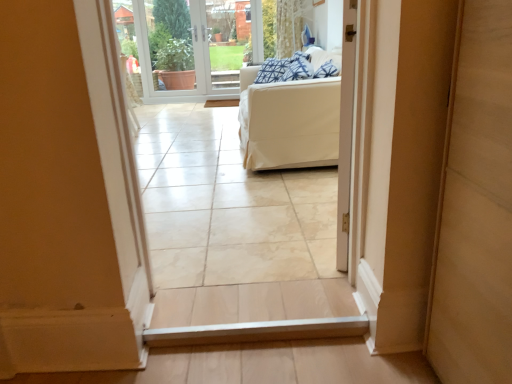
Question: From the image's perspective, is blue patterned pillow at upper center located beneath transparent glass door at center?

Choices:
 (A) yes
 (B) no

Answer: (A)

Question: Is blue patterned pillow at upper center outside transparent glass door at center?

Choices:
 (A) no
 (B) yes

Answer: (B)

Question: Is blue patterned pillow at upper center turned away from transparent glass door at center?

Choices:
 (A) yes
 (B) no

Answer: (B)

Question: Is blue patterned pillow at upper center at the right side of transparent glass door at center?

Choices:
 (A) yes
 (B) no

Answer: (A)

Question: Is blue patterned pillow at upper center not close to transparent glass door at center?

Choices:
 (A) no
 (B) yes

Answer: (B)

Question: Visually, is white plastic window screen at upper center positioned to the left or to the right of transparent glass door at center?

Choices:
 (A) right
 (B) left

Answer: (B)

Question: Looking at their shapes, would you say white plastic window screen at upper center is wider or thinner than transparent glass door at center?

Choices:
 (A) wide
 (B) thin

Answer: (B)

Question: Based on their sizes in the image, would you say white plastic window screen at upper center is bigger or smaller than transparent glass door at center?

Choices:
 (A) big
 (B) small

Answer: (A)

Question: From a real-world perspective, is white plastic window screen at upper center above or below transparent glass door at center?

Choices:
 (A) below
 (B) above

Answer: (A)

Question: Considering the positions of white plastic window screen at upper center and blue patterned pillow at upper center in the image, is white plastic window screen at upper center wider or thinner than blue patterned pillow at upper center?

Choices:
 (A) thin
 (B) wide

Answer: (A)

Question: Is white plastic window screen at upper center taller or shorter than blue patterned pillow at upper center?

Choices:
 (A) short
 (B) tall

Answer: (B)

Question: In terms of size, does white plastic window screen at upper center appear bigger or smaller than blue patterned pillow at upper center?

Choices:
 (A) big
 (B) small

Answer: (A)

Question: Choose the correct answer: Is white plastic window screen at upper center inside blue patterned pillow at upper center or outside it?

Choices:
 (A) outside
 (B) inside

Answer: (A)

Question: Is point (303, 74) positioned closer to the camera than point (245, 0)?

Choices:
 (A) farther
 (B) closer

Answer: (B)

Question: Which is correct: blue patterned pillow at upper center is inside transparent glass door at center, or outside of it?

Choices:
 (A) outside
 (B) inside

Answer: (A)